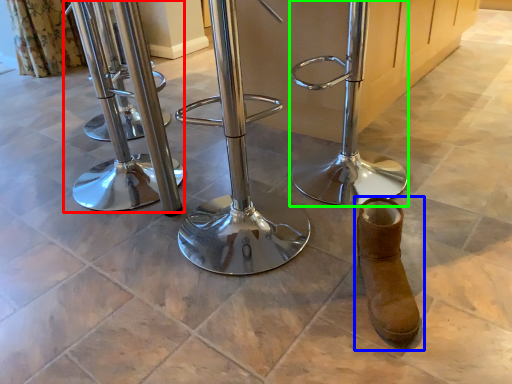
Question: Which object is the farthest from swivel chair (highlighted by a red box)? Choose among these: footwear (highlighted by a blue box) or swivel chair (highlighted by a green box).

Choices:
 (A) footwear
 (B) swivel chair

Answer: (A)